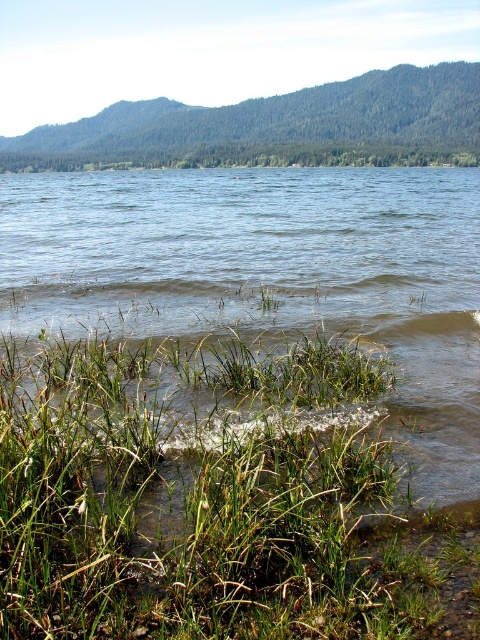
Find the location of a particular element. This screenshot has width=480, height=640. green grassy at lower left is located at coordinates (206, 497).

Which is behind, point (119, 392) or point (120, 214)?

Positioned behind is point (120, 214).

Is point (384, 374) farther from viewer compared to point (460, 433)?

Yes.

The image size is (480, 640). What are the coordinates of `green grassy at lower left` in the screenshot? It's located at coord(206,497).